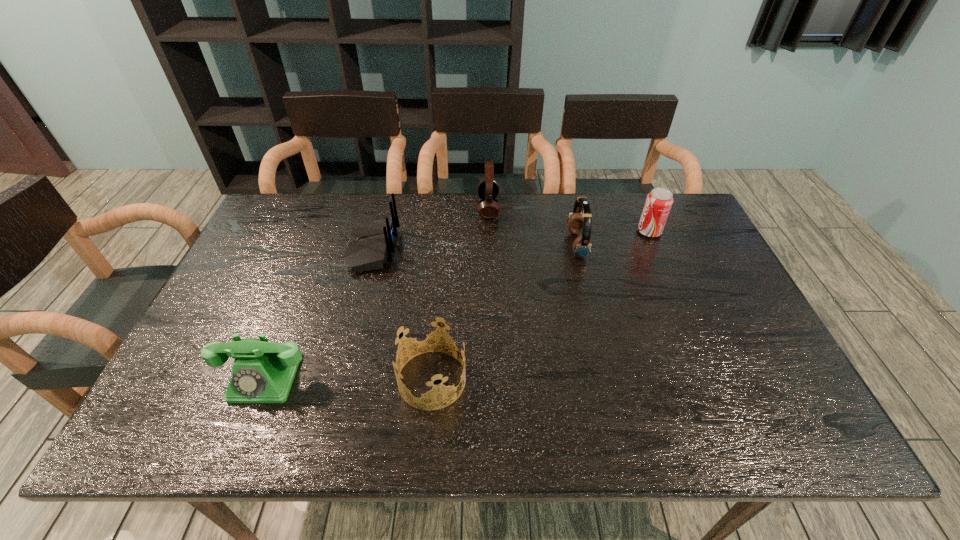
This screenshot has width=960, height=540. What are the coordinates of `the left headset` in the screenshot? It's located at (488, 189).

Find the location of a particular element. This screenshot has height=540, width=960. the fourth object from left to right is located at coordinates (488, 189).

Identify the location of the right headset. (577, 221).

This screenshot has height=540, width=960. Identify the location of the nearer headset. (577, 221).

You are a GUI agent. You are given a task and a screenshot of the screen. Output one action in this format:
    pyautogui.click(x=<x>, y=<y>)
    Task: Click on the rightmost object
    
    Given the screenshot: What is the action you would take?
    pyautogui.click(x=659, y=201)

The height and width of the screenshot is (540, 960). Find the location of `router`. router is located at coordinates (371, 245).

Locate an element on the screen. The image size is (960, 540). telephone is located at coordinates (263, 372).

I want to click on the third object from left to right, so click(x=424, y=334).

Identify the location of free space located 0.250m on the ear pads of the farther headset. (403, 208).

You are a GUI agent. You are given a task and a screenshot of the screen. Output one action in this format:
    pyautogui.click(x=<x>, y=<y>)
    Task: Click on the vacant space located on the ear pads of the farther headset
    This screenshot has width=960, height=540.
    Given the screenshot: What is the action you would take?
    [463, 208]